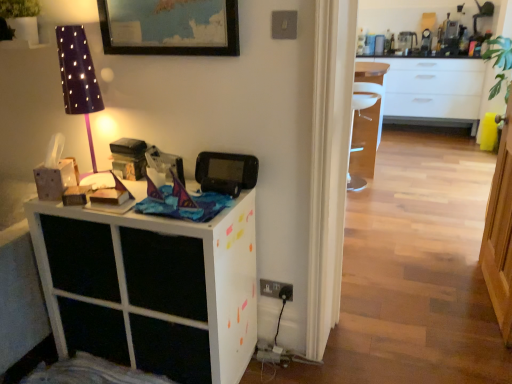
The width and height of the screenshot is (512, 384). I want to click on purple dotted fabric lampshade at upper left, so [x=78, y=77].

The width and height of the screenshot is (512, 384). What do you see at coordinates (78, 77) in the screenshot?
I see `purple dotted fabric lampshade at upper left` at bounding box center [78, 77].

Where is `black plastic game console at upper center`? This screenshot has width=512, height=384. black plastic game console at upper center is located at coordinates [226, 172].

Based on the photo, from the image's perspective, which one is positioned higher, purple dotted fabric lampshade at upper left or white matte cabinet at left?

From the image's view, purple dotted fabric lampshade at upper left is above.

In terms of height, does purple dotted fabric lampshade at upper left look taller or shorter compared to white matte cabinet at left?

purple dotted fabric lampshade at upper left is shorter than white matte cabinet at left.

Does purple dotted fabric lampshade at upper left appear on the left side of white matte cabinet at left?

Correct, you'll find purple dotted fabric lampshade at upper left to the left of white matte cabinet at left.

Are purple dotted fabric lampshade at upper left and white matte cabinet at left beside each other?

No, purple dotted fabric lampshade at upper left is not beside white matte cabinet at left.

Is black plastic game console at upper center positioned before purple dotted fabric lampshade at upper left?

No.

Which of these two, black plastic game console at upper center or purple dotted fabric lampshade at upper left, is bigger?

Answer: purple dotted fabric lampshade at upper left.

Is black plastic game console at upper center oriented towards purple dotted fabric lampshade at upper left?

No, black plastic game console at upper center is not aimed at purple dotted fabric lampshade at upper left.

Would you say purple dotted fabric lampshade at upper left is part of black plastic game console at upper center's contents?

No.

From the image's perspective, is white matte cabinet at left located above black plastic game console at upper center?

No, from the image's perspective, white matte cabinet at left is not over black plastic game console at upper center.

Is white matte cabinet at left positioned beyond the bounds of black plastic game console at upper center?

Yes.

Considering the sizes of objects white matte cabinet at left and black plastic game console at upper center in the image provided, who is taller, white matte cabinet at left or black plastic game console at upper center?

Standing taller between the two is white matte cabinet at left.

Locate an element on the screen. appliance on the right side of white matte cabinet at left is located at coordinates (226, 172).

Can you confirm if purple dotted fabric lampshade at upper left is taller than black plastic game console at upper center?

Yes, purple dotted fabric lampshade at upper left is taller than black plastic game console at upper center.

Looking at this image, is black plastic game console at upper center at the back of purple dotted fabric lampshade at upper left?

No.

Is point (61, 51) closer or farther from the camera than point (229, 175)?

Point (61, 51) is farther from the camera than point (229, 175).

Could you measure the distance between purple dotted fabric lampshade at upper left and black plastic game console at upper center?

purple dotted fabric lampshade at upper left and black plastic game console at upper center are 22.71 inches apart from each other.

From the image's perspective, is black plastic game console at upper center positioned above or below white matte cabinet at left?

black plastic game console at upper center is situated higher than white matte cabinet at left in the image.

Considering the positions of objects black plastic game console at upper center and white matte cabinet at left in the image provided, who is in front, black plastic game console at upper center or white matte cabinet at left?

white matte cabinet at left.

Which is closer to the camera, (202, 175) or (135, 347)?

Clearly, point (202, 175) is closer to the camera than point (135, 347).

In the scene shown: Choose the correct answer: Is white matte cabinet at left inside purple dotted fabric lampshade at upper left or outside it?

white matte cabinet at left cannot be found inside purple dotted fabric lampshade at upper left.

In the scene shown: Between white matte cabinet at left and purple dotted fabric lampshade at upper left, which one has larger width?

white matte cabinet at left is wider.

Considering the positions of objects white matte cabinet at left and purple dotted fabric lampshade at upper left in the image provided, who is in front, white matte cabinet at left or purple dotted fabric lampshade at upper left?

white matte cabinet at left is closer to the camera.

Is white matte cabinet at left aimed at purple dotted fabric lampshade at upper left?

No, white matte cabinet at left is not turned towards purple dotted fabric lampshade at upper left.

Locate an element on the screen. The height and width of the screenshot is (384, 512). cabinetry below the purple dotted fabric lampshade at upper left (from a real-world perspective) is located at coordinates (151, 288).

There is a black plastic game console at upper center. Identify the location of table lamp above it (from a real-world perspective). (78, 77).

Estimate the real-world distances between objects in this image. Which object is further from purple dotted fabric lampshade at upper left, white matte cabinet at left or black plastic game console at upper center?

white matte cabinet at left is positioned further to the anchor purple dotted fabric lampshade at upper left.

When comparing their distances from white matte cabinet at left, does purple dotted fabric lampshade at upper left or black plastic game console at upper center seem further?

purple dotted fabric lampshade at upper left.

Estimate the real-world distances between objects in this image. Which object is further from black plastic game console at upper center, purple dotted fabric lampshade at upper left or white matte cabinet at left?

The object further to black plastic game console at upper center is purple dotted fabric lampshade at upper left.

Based on their spatial positions, is white matte cabinet at left or purple dotted fabric lampshade at upper left further from black plastic game console at upper center?

purple dotted fabric lampshade at upper left is further to black plastic game console at upper center.

In the scene shown: Considering their positions, is black plastic game console at upper center positioned closer to purple dotted fabric lampshade at upper left than white matte cabinet at left?

black plastic game console at upper center lies closer to purple dotted fabric lampshade at upper left than the other object.

Which object lies nearer to the anchor point white matte cabinet at left, black plastic game console at upper center or purple dotted fabric lampshade at upper left?

black plastic game console at upper center is closer to white matte cabinet at left.

Locate an element on the screen. The width and height of the screenshot is (512, 384). appliance between purple dotted fabric lampshade at upper left and white matte cabinet at left in the vertical direction is located at coordinates (226, 172).